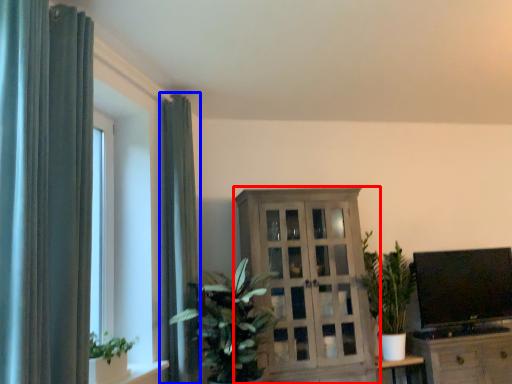
Question: Which object is closer to the camera taking this photo, cabinetry (highlighted by a red box) or curtain (highlighted by a blue box)?

Choices:
 (A) cabinetry
 (B) curtain

Answer: (B)